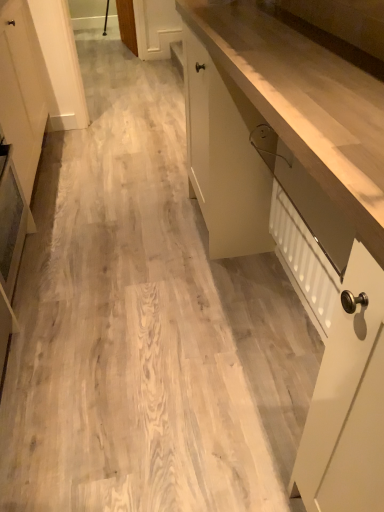
This screenshot has height=512, width=384. In order to click on vacant region under white matte cabinet at right (from a real-world perspective) in this screenshot , I will do `click(268, 332)`.